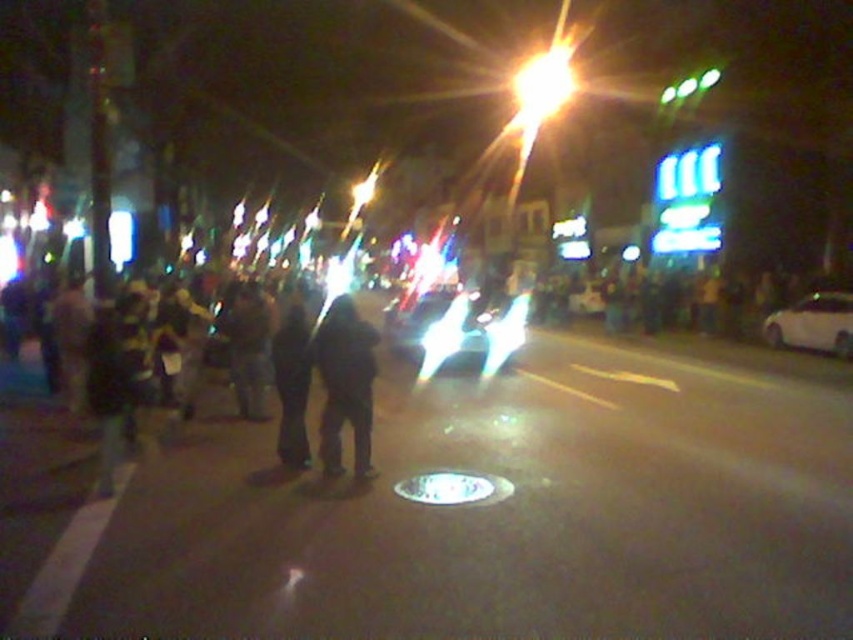
Question: Which point is closer to the camera taking this photo?

Choices:
 (A) (57, 412)
 (B) (299, 317)

Answer: (B)

Question: Is black matte crowd at left wider than dark fabric pants at center?

Choices:
 (A) yes
 (B) no

Answer: (B)

Question: Which of the following is the farthest from the observer?

Choices:
 (A) black matte crowd at left
 (B) white glossy sedan at right
 (C) black matte jacket at center
 (D) dark fabric pants at center

Answer: (B)

Question: Is dark fabric pants at center positioned behind white glossy sedan at right?

Choices:
 (A) yes
 (B) no

Answer: (B)

Question: Can you confirm if black matte crowd at left is positioned above black matte jacket at center?

Choices:
 (A) no
 (B) yes

Answer: (A)

Question: Which point appears closest to the camera in this image?

Choices:
 (A) (363, 428)
 (B) (804, 301)
 (C) (9, 378)

Answer: (A)